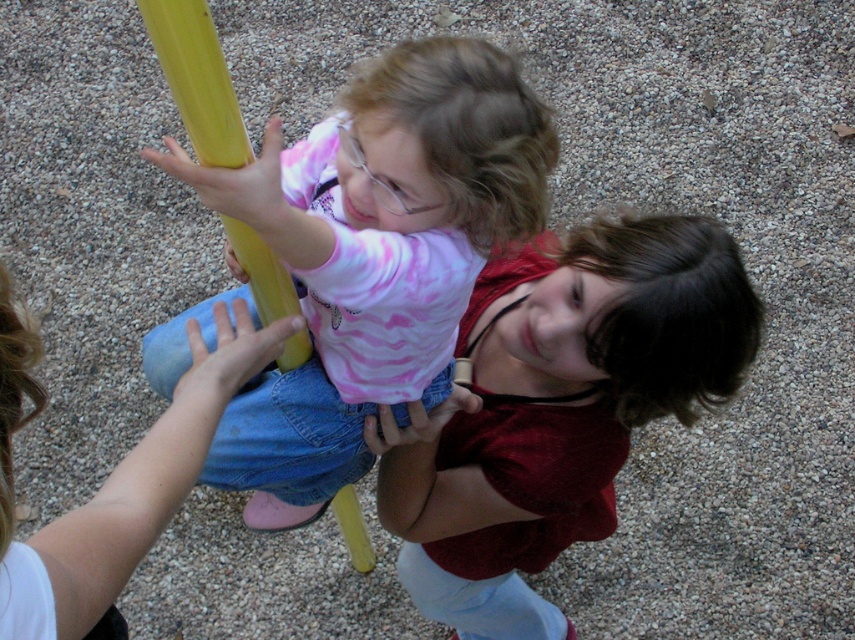
Question: Can you confirm if pink tie-dye shirt at center is smaller than matte red shirt at center?

Choices:
 (A) no
 (B) yes

Answer: (B)

Question: Which point appears closest to the camera in this image?

Choices:
 (A) (505, 488)
 (B) (411, 125)

Answer: (B)

Question: Does pink tie-dye shirt at center have a lesser width compared to matte red shirt at center?

Choices:
 (A) no
 (B) yes

Answer: (A)

Question: Which point is closer to the camera?

Choices:
 (A) pink tie-dye shirt at center
 (B) matte red shirt at center

Answer: (A)

Question: Is pink tie-dye shirt at center below matte red shirt at center?

Choices:
 (A) no
 (B) yes

Answer: (A)